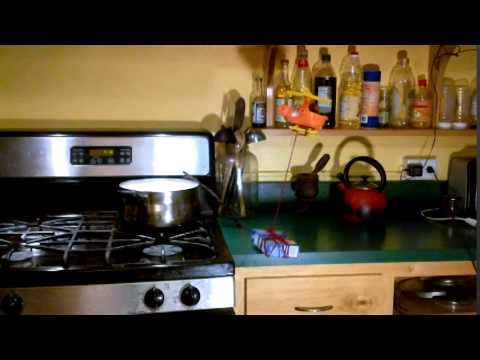
Locate an element on the screen. drawer is located at coordinates (269, 293).